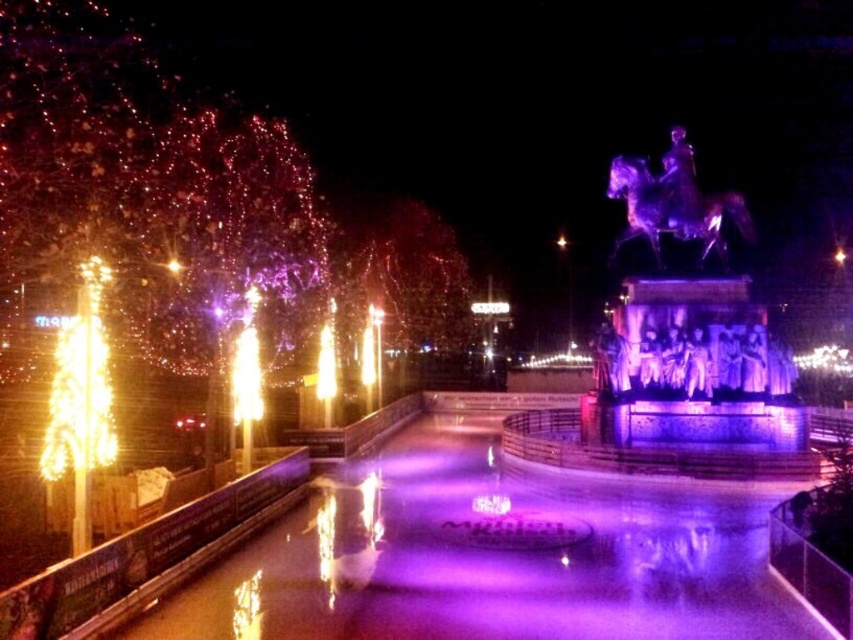
As a tour guide, you want to point out the distance between the purple glossy statue at center and the metallic statue at upper right to your visitors. How far apart are these two statues?

The purple glossy statue at center and the metallic statue at upper right are 16.61 meters apart from each other.

You are standing in the public space and want to take a photo of both the purple glossy statue at center and the metallic statue at upper right. Which statue should you position yourself closer to in order to include both in your camera frame without moving your camera?

You should position yourself closer to the purple glossy statue at center because it is to the left of the metallic statue at upper right, so by moving closer to the one further left, you can better frame both in the camera without moving the camera.

You are an architect designing a new lighting scheme for the public space. You need to ensure that the purple glossy statue at center and the metallic statue at upper right are both adequately lit. Considering their sizes, which statue requires a wider lighting setup to cover its entire surface?

The purple glossy statue at center requires a wider lighting setup because its width surpasses that of the metallic statue at upper right.